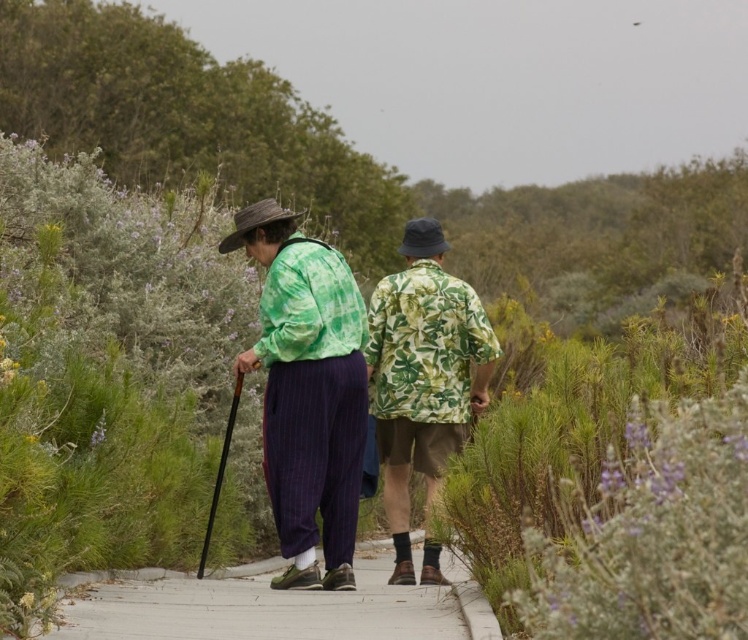
Does green fabric shirt at center appear on the left side of green leafy fabric shirt at center?

Correct, you'll find green fabric shirt at center to the left of green leafy fabric shirt at center.

Can you confirm if green fabric shirt at center is bigger than green leafy fabric shirt at center?

Yes, green fabric shirt at center is bigger than green leafy fabric shirt at center.

What do you see at coordinates (307, 392) in the screenshot?
I see `green fabric shirt at center` at bounding box center [307, 392].

This screenshot has height=640, width=748. I want to click on green fabric shirt at center, so click(307, 392).

Who is more forward, (x=292, y=598) or (x=387, y=513)?

Point (x=292, y=598) is in front.

Does point (144, 582) come closer to viewer compared to point (393, 467)?

Yes.

This screenshot has height=640, width=748. In order to click on concrete at center in this screenshot , I will do `click(272, 605)`.

Is green fabric shirt at center further to camera compared to concrete at center?

Yes, green fabric shirt at center is further from the viewer.

Can you confirm if green fabric shirt at center is positioned to the right of concrete at center?

Indeed, green fabric shirt at center is positioned on the right side of concrete at center.

Who is more distant from viewer, (x=306, y=515) or (x=162, y=634)?

The point (x=306, y=515) is behind.

This screenshot has height=640, width=748. Find the location of `green fabric shirt at center`. green fabric shirt at center is located at coordinates (307, 392).